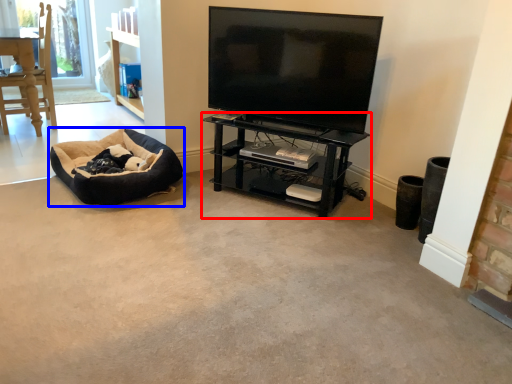
Question: Which object is closer to the camera taking this photo, shelf (highlighted by a red box) or dog bed (highlighted by a blue box)?

Choices:
 (A) shelf
 (B) dog bed

Answer: (A)